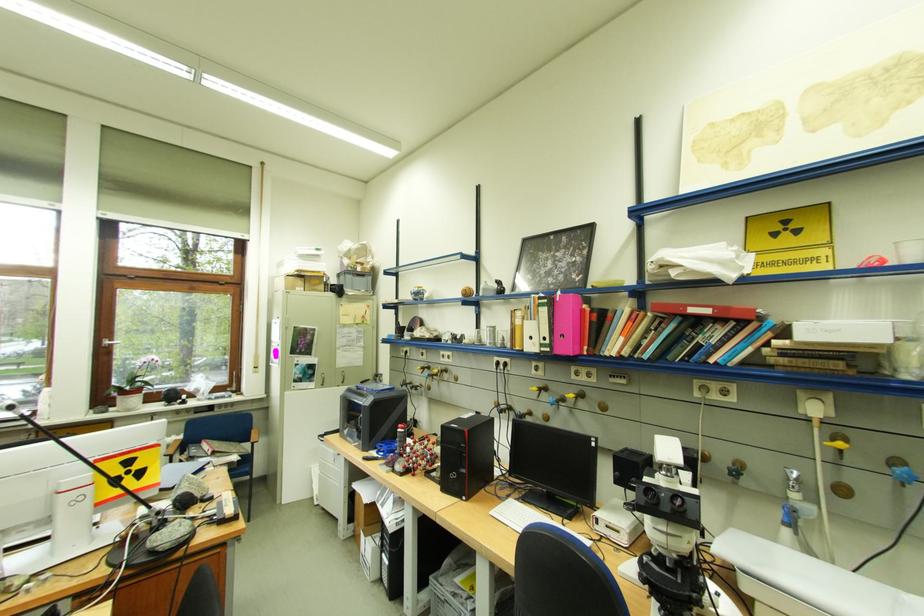
Locate an element on the screen. microscope focus knob is located at coordinates (674, 600).